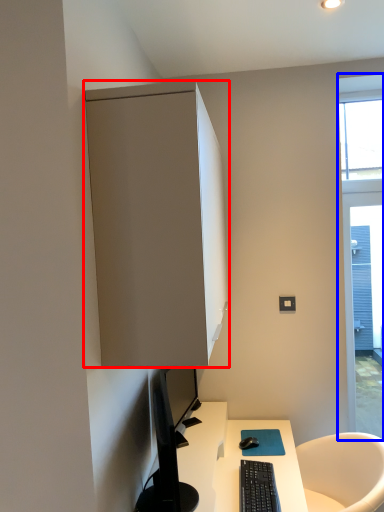
Question: Which object appears farthest to the camera in this image, cabinetry (highlighted by a red box) or window (highlighted by a blue box)?

Choices:
 (A) cabinetry
 (B) window

Answer: (B)